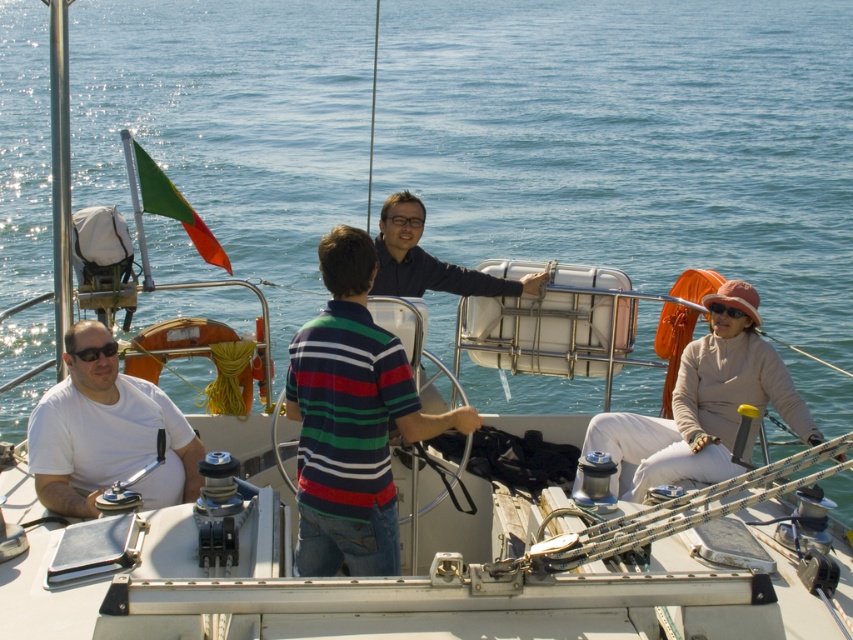
Between striped cotton shirt at center and black plastic sunglasses at left, which one has less height?

black plastic sunglasses at left is shorter.

Measure the distance between striped cotton shirt at center and black plastic sunglasses at left.

striped cotton shirt at center is 5.71 feet from black plastic sunglasses at left.

Is point (341, 339) more distant than point (102, 353)?

That is False.

Find the location of a particular element. The height and width of the screenshot is (640, 853). striped cotton shirt at center is located at coordinates (351, 419).

Is black plastic sunglasses at left above sunglasses at center?

No, black plastic sunglasses at left is not above sunglasses at center.

How far apart are black plastic sunglasses at left and sunglasses at center?

black plastic sunglasses at left is 14.98 feet away from sunglasses at center.

You are a GUI agent. You are given a task and a screenshot of the screen. Output one action in this format:
    pyautogui.click(x=<x>, y=<y>)
    Task: Click on the black plastic sunglasses at left
    This screenshot has height=640, width=853.
    Given the screenshot: What is the action you would take?
    pyautogui.click(x=96, y=352)

I want to click on black plastic sunglasses at left, so click(96, 352).

Can you confirm if striped cotton shirt at center is positioned above sunglasses at center?

Actually, striped cotton shirt at center is below sunglasses at center.

Identify the location of striped cotton shirt at center. (351, 419).